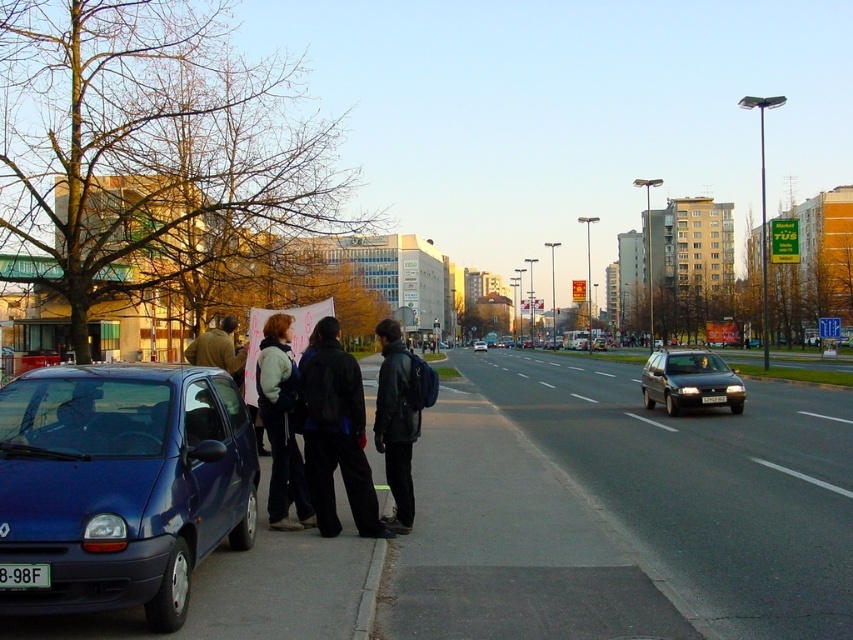
Question: Which object appears farthest from the camera in this image?

Choices:
 (A) black asphalt pavement at lower right
 (B) brown leather jacket at center

Answer: (B)

Question: From the image, what is the correct spatial relationship of black asphalt pavement at lower right in relation to black plastic license plate at lower left?

Choices:
 (A) below
 (B) above

Answer: (A)

Question: Can you confirm if metallic blue hatchback at lower left is wider than black plastic license plate at lower left?

Choices:
 (A) yes
 (B) no

Answer: (A)

Question: Which point appears closest to the camera in this image?

Choices:
 (A) (473, 349)
 (B) (296, 372)
 (C) (425, 372)
 (D) (770, 484)

Answer: (C)

Question: Based on their relative distances, which object is farther from the matte black sedan at center?

Choices:
 (A) matte black suv at center right
 (B) light blue fleece jacket at center
 (C) black asphalt pavement at lower right

Answer: (B)

Question: Can you confirm if metallic blue hatchback at lower left is wider than black leather jacket at center?

Choices:
 (A) yes
 (B) no

Answer: (A)